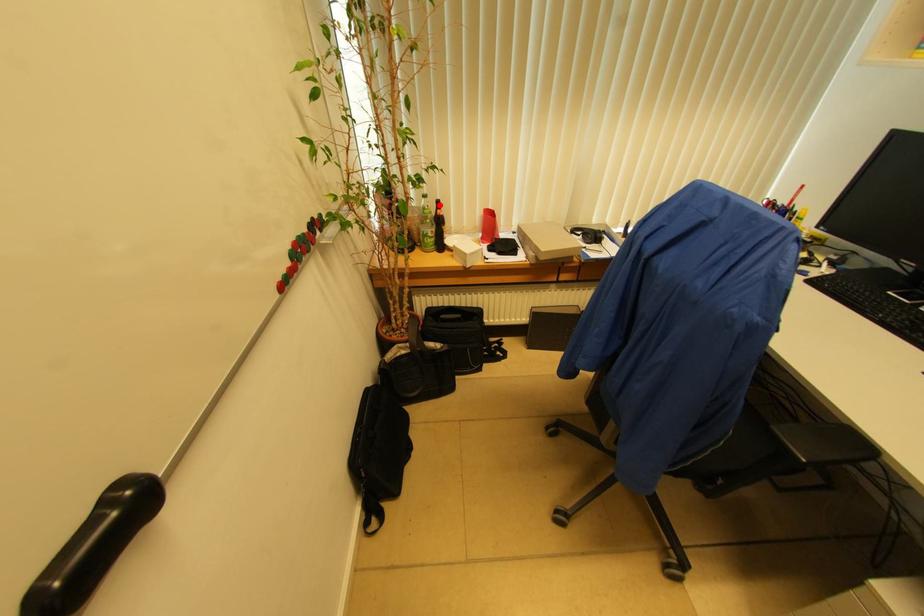
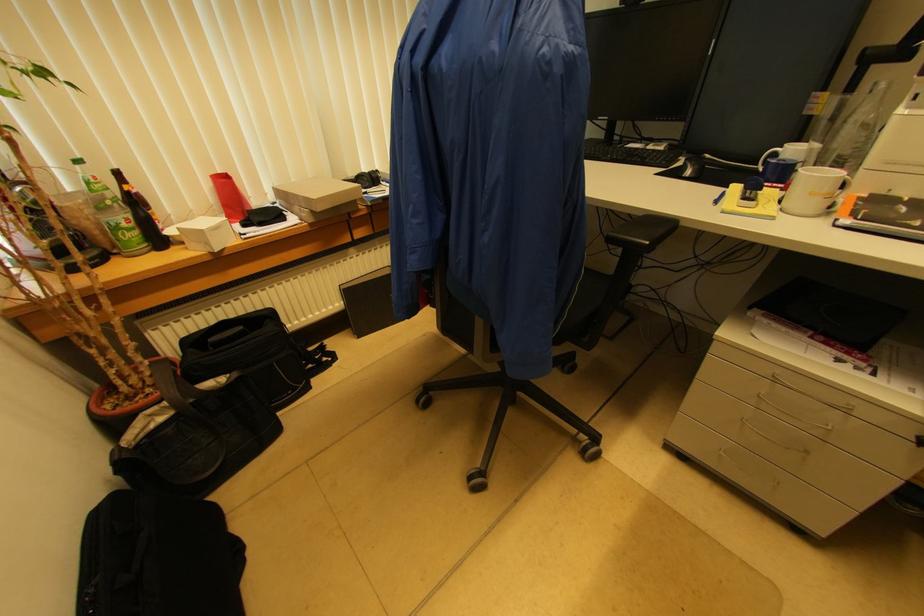
Locate, in the second image, the point that corresponds to the highlighted location in the first image.

(118, 176)